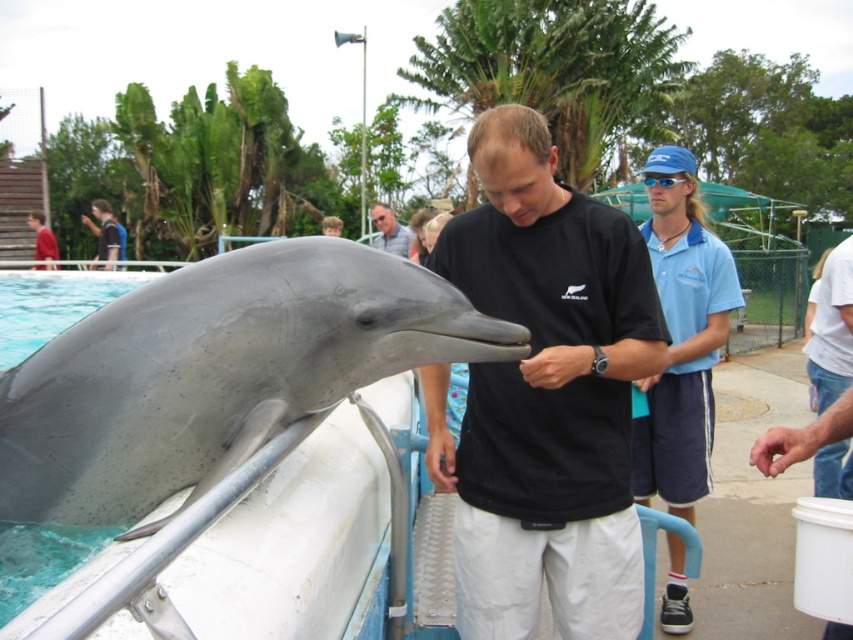
You are a zookeeper who needs to ensure safety during dolphin interactions. The safety guideline states that the minimum safe distance between a person and the dolphin should be 70 centimeters. Based on the scene, is the current distance between the black matte shirt at center and the gray matte dolphin at left compliant with the safety guideline?

The distance between the black matte shirt at center and the gray matte dolphin at left is 66.41 centimeters, which is less than the required 70 centimeters. Therefore, the current distance does not comply with the safety guideline.

You are a zookeeper observing the dolphin encounter area. You notice the black matte shirt at center and the gray matte dolphin at center. Which object is positioned higher in the scene?

The gray matte dolphin at center is positioned higher than the black matte shirt at center according to the description.